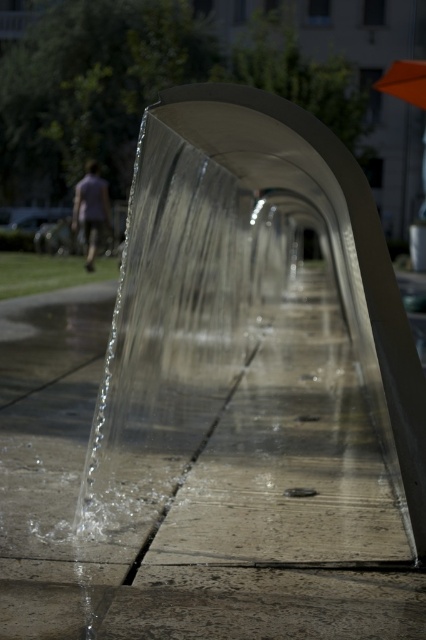
Between light purple shirt at left and orange fabric umbrella at upper right, which one appears on the left side from the viewer's perspective?

Positioned to the left is light purple shirt at left.

Is light purple shirt at left below orange fabric umbrella at upper right?

Indeed, light purple shirt at left is positioned under orange fabric umbrella at upper right.

Does point (103, 200) come closer to viewer compared to point (385, 74)?

No.

Where is `light purple shirt at left`? This screenshot has height=640, width=426. light purple shirt at left is located at coordinates click(91, 209).

Does smooth concrete pavement at center appear on the right side of orange fabric umbrella at upper right?

No, smooth concrete pavement at center is not to the right of orange fabric umbrella at upper right.

Who is more forward, (25, 420) or (412, 102)?

Point (25, 420)

Where is `smooth concrete pavement at center`? This screenshot has width=426, height=640. smooth concrete pavement at center is located at coordinates (206, 496).

Between point (391, 602) and point (103, 189), which one is positioned in front?

Point (391, 602) is more forward.

Does smooth concrete pavement at center have a lesser height compared to light purple shirt at left?

No.

The image size is (426, 640). Find the location of `smooth concrete pavement at center`. smooth concrete pavement at center is located at coordinates (206, 496).